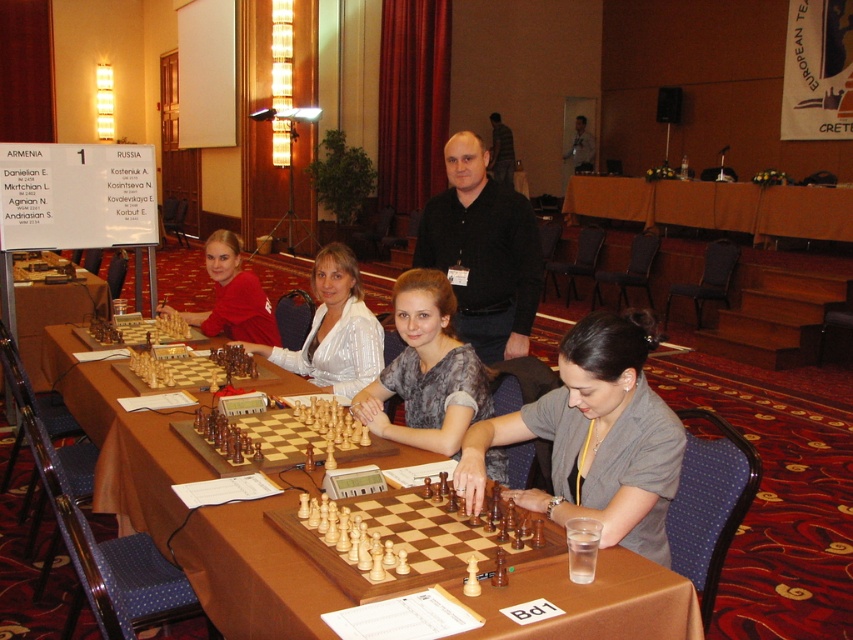
Question: Does brown wooden table at center appear on the left side of brown wooden chessboard at left?

Choices:
 (A) yes
 (B) no

Answer: (B)

Question: Can you confirm if black matte shirt at center is smaller than black shirt at center?

Choices:
 (A) yes
 (B) no

Answer: (B)

Question: Which point appears closest to the camera in this image?

Choices:
 (A) (252, 534)
 (B) (138, 378)

Answer: (A)

Question: Which is nearer to the white silk blouse at center?

Choices:
 (A) matte gray blazer at center
 (B) matte white shirt at center
 (C) black shirt at center

Answer: (B)

Question: Which is farther from the matte gray blazer at center?

Choices:
 (A) dark gray shirt at center
 (B) light brown wood chessboard at center
 (C) black matte shirt at center
 (D) black shirt at center

Answer: (D)

Question: Is light brown wooden chessboard at center bigger than white silk blouse at center?

Choices:
 (A) yes
 (B) no

Answer: (B)